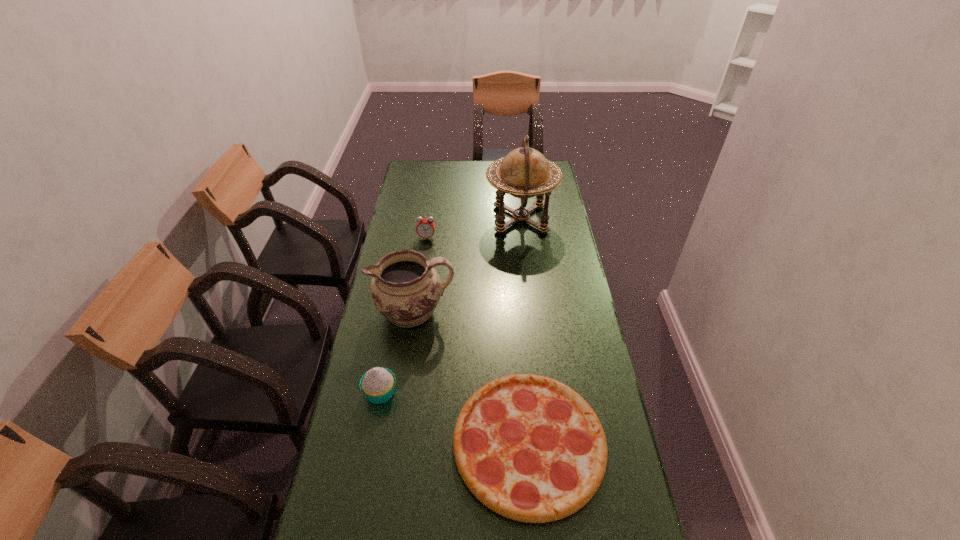
Locate an element on the screen. globe is located at coordinates (524, 173).

Identify the location of the second tallest object. This screenshot has height=540, width=960. (405, 288).

The image size is (960, 540). Find the location of `pitcher`. pitcher is located at coordinates (405, 288).

I want to click on cupcake, so click(x=378, y=384).

Locate an element on the screen. alarm clock is located at coordinates (425, 228).

Find the location of a particular element. Image resolution: width=960 pixels, height=540 pixels. pizza is located at coordinates point(528,447).

Where is `free space located 0.130m on the front-facing side of the tallest object`? free space located 0.130m on the front-facing side of the tallest object is located at coordinates (456, 219).

This screenshot has width=960, height=540. I want to click on vacant point located 0.070m on the front-facing side of the tallest object, so click(x=469, y=219).

At what (x,y) coordinates should I click in order to perform the action: click on free point located on the front-facing side of the tallest object. Please return your answer as a coordinate pair (x, y). This screenshot has height=540, width=960. Looking at the image, I should click on (410, 219).

This screenshot has width=960, height=540. In order to click on blank area located 0.200m on the front of the cupcake in this screenshot , I will do `click(364, 479)`.